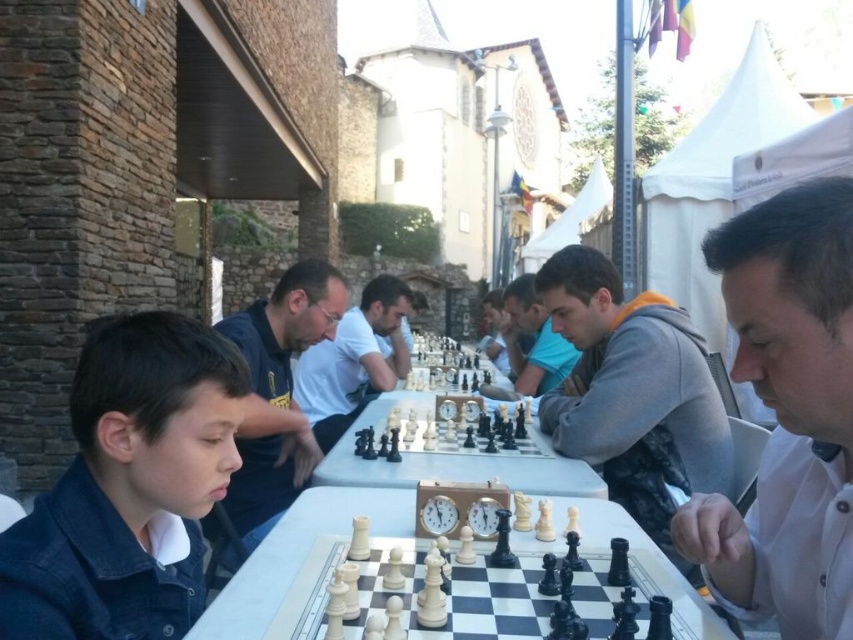
Does dark blue denim jacket at lower left have a smaller size compared to white shirt at center?

Indeed, dark blue denim jacket at lower left has a smaller size compared to white shirt at center.

Between dark blue denim jacket at lower left and white shirt at center, which one is positioned higher?

Positioned higher is dark blue denim jacket at lower left.

Measure the distance between point (30, 628) and camera.

They are 3.49 feet apart.

At what (x,y) coordinates should I click in order to perform the action: click on dark blue denim jacket at lower left. Please return your answer as a coordinate pair (x, y). Looking at the image, I should click on (129, 486).

Is white shirt at right to the right of white shirt at center from the viewer's perspective?

Correct, you'll find white shirt at right to the right of white shirt at center.

The height and width of the screenshot is (640, 853). What do you see at coordinates (787, 413) in the screenshot? I see `white shirt at right` at bounding box center [787, 413].

At what (x,y) coordinates should I click in order to perform the action: click on white shirt at right. Please return your answer as a coordinate pair (x, y). Image resolution: width=853 pixels, height=640 pixels. Looking at the image, I should click on (787, 413).

Which is behind, point (717, 573) or point (618, 433)?

Positioned behind is point (618, 433).

Does point (807, 348) come farther from viewer compared to point (648, 456)?

No, it is not.

Which is in front, point (788, 396) or point (582, 420)?

Point (788, 396)

Image resolution: width=853 pixels, height=640 pixels. Find the location of `white shirt at right`. white shirt at right is located at coordinates (787, 413).